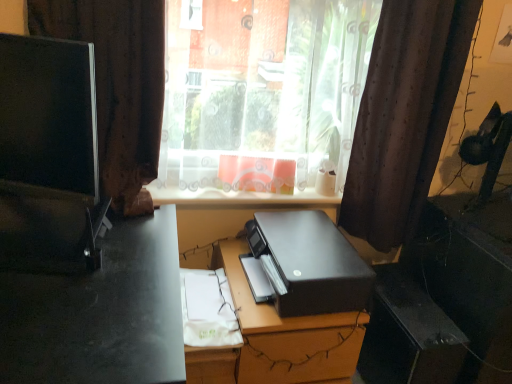
The width and height of the screenshot is (512, 384). Identify the location of matte black desk at left. (100, 314).

Where is `brown sheer curtain at right, placed as the second curtain when sorted from left to right`? This screenshot has height=384, width=512. brown sheer curtain at right, placed as the second curtain when sorted from left to right is located at coordinates pyautogui.click(x=404, y=116).

What do you see at coordinates (404, 116) in the screenshot? The image size is (512, 384). I see `brown sheer curtain at right, placed as the second curtain when sorted from left to right` at bounding box center [404, 116].

Describe the element at coordinates (48, 118) in the screenshot. I see `matte black monitor at left` at that location.

This screenshot has width=512, height=384. I want to click on transparent plastic window at center, so click(265, 99).

The image size is (512, 384). I want to click on matte black desk at left, so click(100, 314).

Consider the image. Is black matte printer at center facing towards black plastic file cabinet at center?

No, black matte printer at center is not facing towards black plastic file cabinet at center.

Between black matte printer at center and black plastic file cabinet at center, which one has smaller width?

black matte printer at center.

How different are the orientations of black matte printer at center and black plastic file cabinet at center in degrees?

1.61 degrees separate the facing orientations of black matte printer at center and black plastic file cabinet at center.

Would you say black matte printer at center is part of matte black monitor at left's contents?

No, matte black monitor at left does not contain black matte printer at center.

From the image's perspective, is matte black monitor at left on black matte printer at center?

Yes, from the image's perspective, matte black monitor at left is above black matte printer at center.

From a real-world perspective, which is physically below, matte black monitor at left or black matte printer at center?

black matte printer at center, from a real-world perspective.

Measure the distance between brown sheer curtain at right, acting as the first curtain starting from the right, and matte black desk at left.

37.71 inches.

In order to click on desk to the left of brown sheer curtain at right, placed as the second curtain when sorted from left to right in this screenshot , I will do `click(100, 314)`.

Would you say brown sheer curtain at right, placed as the second curtain when sorted from left to right, contains matte black desk at left?

No, matte black desk at left is located outside of brown sheer curtain at right, placed as the second curtain when sorted from left to right.

Considering the sizes of objects brown sheer curtain at right, placed as the second curtain when sorted from left to right, and matte black desk at left in the image provided, who is thinner, brown sheer curtain at right, placed as the second curtain when sorted from left to right, or matte black desk at left?

With smaller width is brown sheer curtain at right, placed as the second curtain when sorted from left to right.

From the picture: Does black matte printer at center have a greater height compared to black matte printer at center?

Yes, black matte printer at center is taller than black matte printer at center.

Is black matte printer at center smaller than black matte printer at center?

Incorrect, black matte printer at center is not smaller in size than black matte printer at center.

The width and height of the screenshot is (512, 384). In order to click on printer on the right side of black matte printer at center in this screenshot , I will do `click(309, 263)`.

Which is behind, brown sheer curtain at right, placed as the second curtain when sorted from left to right, or brown fabric curtain at left, which appears as the 1th curtain when viewed from the left?

brown sheer curtain at right, placed as the second curtain when sorted from left to right, is more distant.

Is brown sheer curtain at right, placed as the second curtain when sorted from left to right, facing towards brown fabric curtain at left, the second curtain positioned from the right?

No, brown sheer curtain at right, placed as the second curtain when sorted from left to right, is not oriented towards brown fabric curtain at left, the second curtain positioned from the right.

Considering the sizes of objects brown sheer curtain at right, acting as the first curtain starting from the right, and brown fabric curtain at left, which appears as the 1th curtain when viewed from the left, in the image provided, who is taller, brown sheer curtain at right, acting as the first curtain starting from the right, or brown fabric curtain at left, which appears as the 1th curtain when viewed from the left,?

Standing taller between the two is brown sheer curtain at right, acting as the first curtain starting from the right.

From the image's perspective, which is below, brown sheer curtain at right, acting as the first curtain starting from the right, or black matte printer at center?

From the image's view, black matte printer at center is below.

Is brown sheer curtain at right, acting as the first curtain starting from the right, turned away from black matte printer at center?

That's not correct — brown sheer curtain at right, acting as the first curtain starting from the right, is not looking away from black matte printer at center.

From a real-world perspective, which is physically below, brown sheer curtain at right, acting as the first curtain starting from the right, or black matte printer at center?

In real-world perspective, black matte printer at center is lower.

This screenshot has height=384, width=512. In the image, there is a brown sheer curtain at right, placed as the second curtain when sorted from left to right. Find the location of `computer desk below it (from the image's perspective)`. computer desk below it (from the image's perspective) is located at coordinates (288, 334).

From the image's perspective, is brown fabric curtain at left, the second curtain positioned from the right, under black matte printer at center?

No.

Does brown fabric curtain at left, which appears as the 1th curtain when viewed from the left, have a greater height compared to black matte printer at center?

Correct, brown fabric curtain at left, which appears as the 1th curtain when viewed from the left, is much taller as black matte printer at center.

How much distance is there between brown fabric curtain at left, the second curtain positioned from the right, and black matte printer at center?

brown fabric curtain at left, the second curtain positioned from the right, and black matte printer at center are 23.98 inches apart from each other.

Where is `the 2nd curtain above the black matte printer at center (from a real-world perspective)`? the 2nd curtain above the black matte printer at center (from a real-world perspective) is located at coordinates (118, 86).

This screenshot has width=512, height=384. I want to click on printer on the left of the black plastic file cabinet at center, so click(309, 263).

There is a black matte printer at center. Where is `computer monitor above it (from a real-world perspective)`? The width and height of the screenshot is (512, 384). computer monitor above it (from a real-world perspective) is located at coordinates (48, 118).

Estimate the real-world distances between objects in this image. Which object is further from black matte printer at center, black plastic file cabinet at center or matte black monitor at left?

matte black monitor at left is positioned further to the anchor black matte printer at center.

Considering their positions, is matte black desk at left positioned closer to matte black monitor at left than brown sheer curtain at right, placed as the second curtain when sorted from left to right?

matte black desk at left.

Looking at the image, which one is located closer to brown sheer curtain at right, acting as the first curtain starting from the right, black plastic file cabinet at center or black matte printer at center?

The object closer to brown sheer curtain at right, acting as the first curtain starting from the right, is black plastic file cabinet at center.

Which object lies nearer to the anchor point matte black desk at left, black matte printer at center or matte black monitor at left?

matte black monitor at left is positioned closer to the anchor matte black desk at left.

Which object lies further to the anchor point brown sheer curtain at right, placed as the second curtain when sorted from left to right, matte black monitor at left or black plastic file cabinet at center?

The object further to brown sheer curtain at right, placed as the second curtain when sorted from left to right, is matte black monitor at left.

Based on their spatial positions, is black matte printer at center or black matte printer at center further from brown sheer curtain at right, placed as the second curtain when sorted from left to right?

Based on the image, black matte printer at center appears to be further to brown sheer curtain at right, placed as the second curtain when sorted from left to right.

Considering their positions, is brown fabric curtain at left, which appears as the 1th curtain when viewed from the left, positioned closer to black matte printer at center than matte black desk at left?

matte black desk at left is closer to black matte printer at center.

Based on the photo, from the image, which object appears to be farther from brown sheer curtain at right, acting as the first curtain starting from the right, brown fabric curtain at left, which appears as the 1th curtain when viewed from the left, or matte black monitor at left?

Based on the image, matte black monitor at left appears to be further to brown sheer curtain at right, acting as the first curtain starting from the right.

Where is `window situated between matte black desk at left and black plastic file cabinet at center from left to right`? The image size is (512, 384). window situated between matte black desk at left and black plastic file cabinet at center from left to right is located at coordinates (265, 99).

The height and width of the screenshot is (384, 512). In order to click on printer between transparent plastic window at center and black matte printer at center vertically in this screenshot , I will do `click(309, 263)`.

Where is `curtain between matte black monitor at left and brown sheer curtain at right, acting as the first curtain starting from the right, from left to right`? This screenshot has height=384, width=512. curtain between matte black monitor at left and brown sheer curtain at right, acting as the first curtain starting from the right, from left to right is located at coordinates (118, 86).

The height and width of the screenshot is (384, 512). Identify the location of curtain between matte black monitor at left and black plastic file cabinet at center. (118, 86).